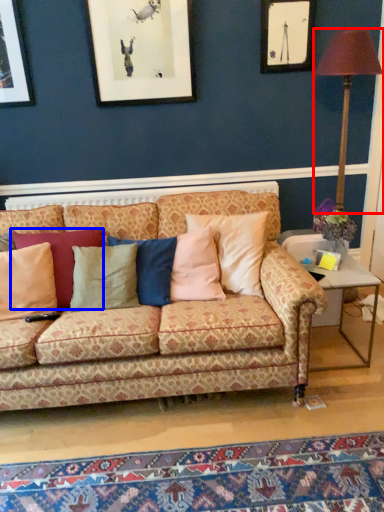
Question: Which object is closer to the camera taking this photo, table lamp (highlighted by a red box) or pillow (highlighted by a blue box)?

Choices:
 (A) table lamp
 (B) pillow

Answer: (B)